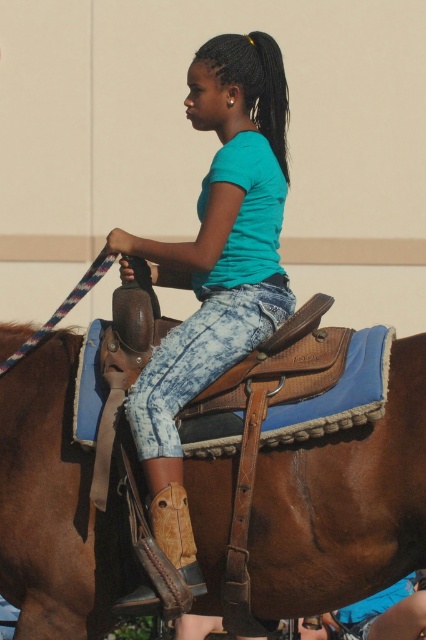
You are a photographer trying to capture the rider and the horse in a photo. You want to ensure that the brown leather saddle at center is centered in your shot. Given that the saddle is represented by the point at coordinates point (344, 504), what should you adjust to make sure the saddle is perfectly centered?

To center the brown leather saddle at center, adjust your camera so that the point (344, 504) aligns with the center of the frame.

Based on the scene description, where is the brown leather saddle at center in relation to the teal matte shirt at center?

The brown leather saddle at center is to the right of the teal matte shirt at center.

You are a photographer setting up a shoot. You need to ensure that the brown leather saddle at center and the teal matte shirt at center are both visible in the frame. Based on their sizes, which object should you focus on first to ensure it fits within the camera frame?

The brown leather saddle at center is shorter than the teal matte shirt at center, so you should focus on ensuring the teal matte shirt at center is within the frame first since it is taller and requires more space vertically.